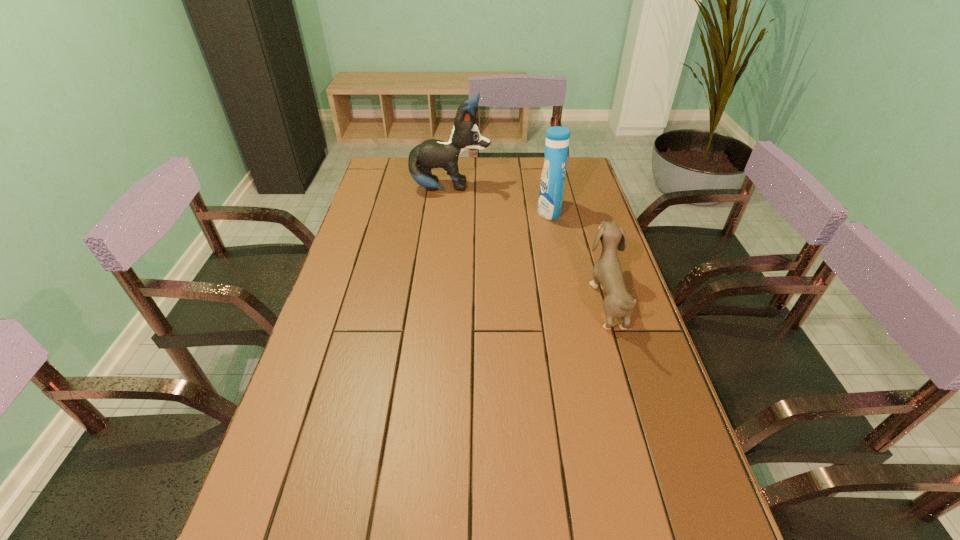
This screenshot has width=960, height=540. In order to click on blank region between the shortest object and the second farthest object in this screenshot , I will do pos(578,256).

Locate an element on the screen. This screenshot has height=540, width=960. vacant space in between the left puppy and the right puppy is located at coordinates (528, 244).

The width and height of the screenshot is (960, 540). I want to click on vacant area between the taller puppy and the nearest object, so click(528, 244).

Locate an element on the screen. The image size is (960, 540). vacant area that lies between the detergent and the farthest object is located at coordinates (500, 200).

At what (x,y) coordinates should I click in order to perform the action: click on vacant area that lies between the taller puppy and the second object from right to left. Please return your answer as a coordinate pair (x, y). Looking at the image, I should click on (500, 200).

At what (x,y) coordinates should I click in order to perform the action: click on free spot between the shortest object and the taller puppy. Please return your answer as a coordinate pair (x, y). Looking at the image, I should click on [528, 244].

Locate an element on the screen. This screenshot has width=960, height=540. object that stands as the second closest to the second object from left to right is located at coordinates (607, 271).

Identify which object is located as the second nearest to the farther puppy. Please provide its 2D coordinates. Your answer should be formatted as a tuple, i.e. [(x, y)], where the tuple contains the x and y coordinates of a point satisfying the conditions above.

[(607, 271)]